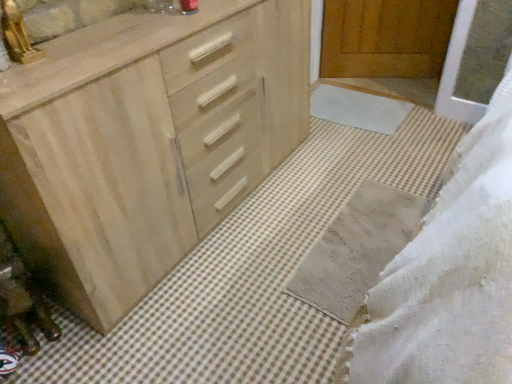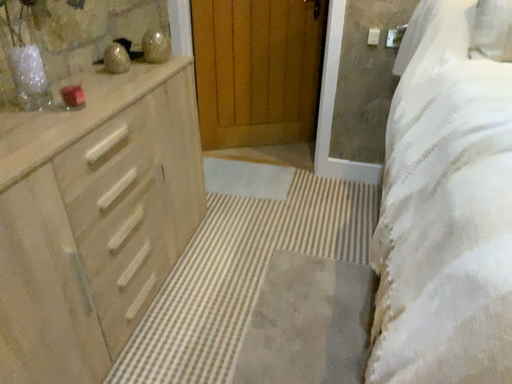
Question: Which way did the camera rotate in the video?

Choices:
 (A) rotated right
 (B) rotated left

Answer: (A)